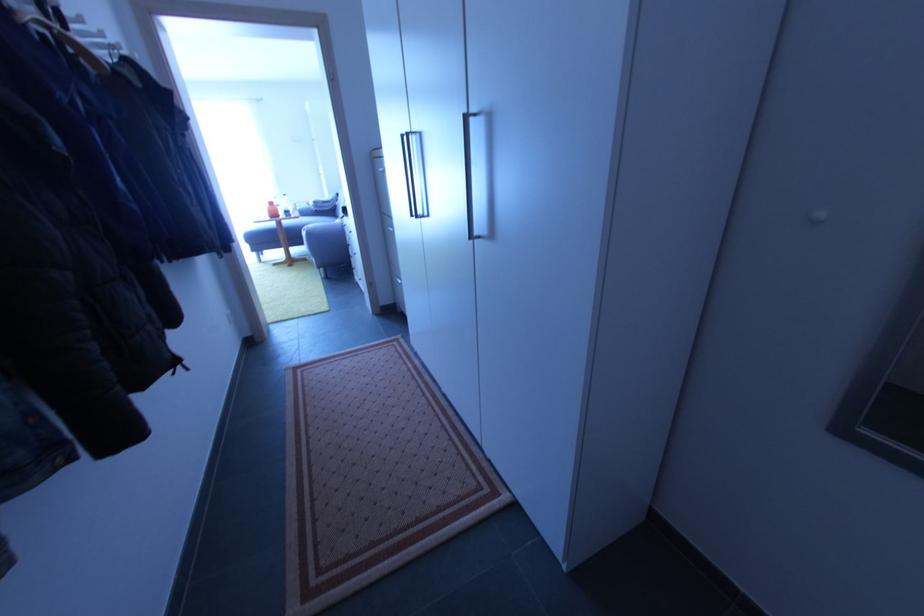
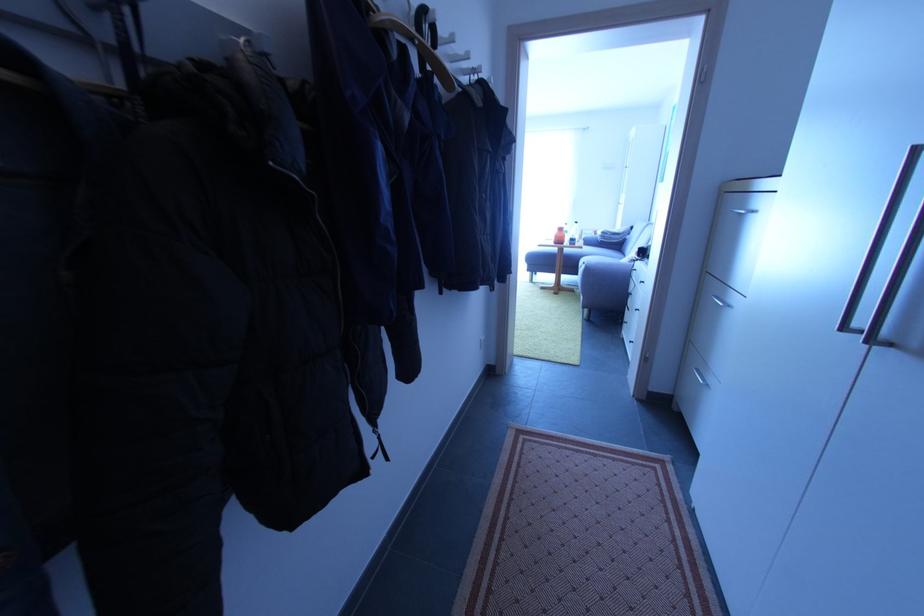
Find the pixel in the second image that matches point (300, 213) in the first image.

(585, 238)